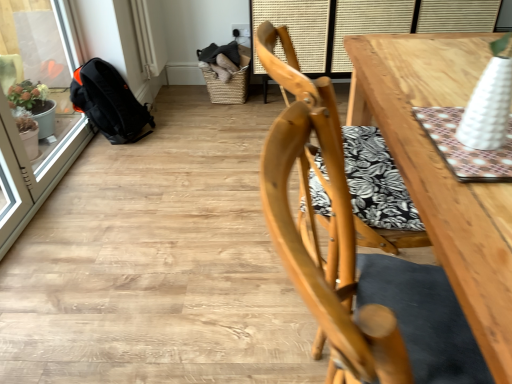
Question: Considering the relative sizes of woven brown basket at upper center and transparent glass screen door at left in the image provided, is woven brown basket at upper center bigger than transparent glass screen door at left?

Choices:
 (A) no
 (B) yes

Answer: (A)

Question: Is woven brown basket at upper center at the left side of transparent glass screen door at left?

Choices:
 (A) yes
 (B) no

Answer: (B)

Question: Can you confirm if woven brown basket at upper center is taller than transparent glass screen door at left?

Choices:
 (A) no
 (B) yes

Answer: (A)

Question: Can you confirm if woven brown basket at upper center is shorter than transparent glass screen door at left?

Choices:
 (A) yes
 (B) no

Answer: (A)

Question: Is woven brown basket at upper center not inside transparent glass screen door at left?

Choices:
 (A) yes
 (B) no

Answer: (A)

Question: Is woven brown basket at upper center at the right side of transparent glass screen door at left?

Choices:
 (A) no
 (B) yes

Answer: (B)

Question: Is wooden table at upper right not near woven brown basket at upper center?

Choices:
 (A) no
 (B) yes

Answer: (A)

Question: Is wooden table at upper right behind woven brown basket at upper center?

Choices:
 (A) no
 (B) yes

Answer: (A)

Question: Can you confirm if wooden table at upper right is shorter than woven brown basket at upper center?

Choices:
 (A) yes
 (B) no

Answer: (B)

Question: Does wooden table at upper right have a greater width compared to woven brown basket at upper center?

Choices:
 (A) yes
 (B) no

Answer: (A)

Question: Is wooden table at upper right smaller than woven brown basket at upper center?

Choices:
 (A) yes
 (B) no

Answer: (B)

Question: From the image's perspective, is wooden table at upper right beneath woven brown basket at upper center?

Choices:
 (A) no
 (B) yes

Answer: (A)

Question: Does woven brown basket at upper center have a lesser width compared to light wood chair at center?

Choices:
 (A) no
 (B) yes

Answer: (B)